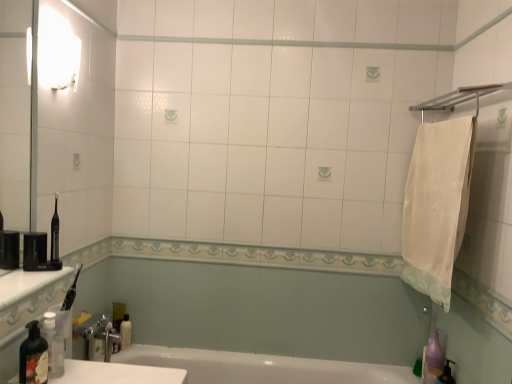
Question: Is there a large distance between transparent plastic bottle at lower left, the first bottle viewed from the back, and white glossy bottle at lower left?

Choices:
 (A) no
 (B) yes

Answer: (A)

Question: From a real-world perspective, is transparent plastic bottle at lower left, the first bottle viewed from the back, positioned over white glossy bottle at lower left based on gravity?

Choices:
 (A) yes
 (B) no

Answer: (A)

Question: Can you confirm if transparent plastic bottle at lower left, the first bottle viewed from the back, is positioned to the left of white glossy bottle at lower left?

Choices:
 (A) yes
 (B) no

Answer: (B)

Question: Can you confirm if transparent plastic bottle at lower left, the 2th bottle from the front, is thinner than white glossy bottle at lower left?

Choices:
 (A) no
 (B) yes

Answer: (A)

Question: Does transparent plastic bottle at lower left, the first bottle viewed from the back, have a smaller size compared to white glossy bottle at lower left?

Choices:
 (A) yes
 (B) no

Answer: (B)

Question: Is white glossy bottle at lower left bigger or smaller than white glossy sink at lower left?

Choices:
 (A) small
 (B) big

Answer: (A)

Question: Does point (128, 344) appear closer or farther from the camera than point (115, 380)?

Choices:
 (A) farther
 (B) closer

Answer: (A)

Question: Considering the positions of white glossy bottle at lower left and white glossy sink at lower left in the image, is white glossy bottle at lower left taller or shorter than white glossy sink at lower left?

Choices:
 (A) tall
 (B) short

Answer: (B)

Question: Considering the relative positions of white glossy bottle at lower left and white glossy sink at lower left in the image provided, is white glossy bottle at lower left to the left or to the right of white glossy sink at lower left?

Choices:
 (A) right
 (B) left

Answer: (B)

Question: Looking at their shapes, would you say transparent plastic bottle at lower left, the 2th bottle from the front, is wider or thinner than white cotton towel at right?

Choices:
 (A) thin
 (B) wide

Answer: (A)

Question: Visually, is transparent plastic bottle at lower left, the 2th bottle from the front, positioned to the left or to the right of white cotton towel at right?

Choices:
 (A) right
 (B) left

Answer: (B)

Question: Is transparent plastic bottle at lower left, the first bottle viewed from the back, in front of or behind white cotton towel at right in the image?

Choices:
 (A) front
 (B) behind

Answer: (A)

Question: From a real-world perspective, is transparent plastic bottle at lower left, the first bottle viewed from the back, above or below white cotton towel at right?

Choices:
 (A) above
 (B) below

Answer: (B)

Question: From a real-world perspective, relative to white glossy sink at lower left, is translucent plastic soap dispenser at lower left, the first bottle in the front-to-back sequence, vertically above or below?

Choices:
 (A) below
 (B) above

Answer: (B)

Question: Looking at their shapes, would you say translucent plastic soap dispenser at lower left, the first bottle in the front-to-back sequence, is wider or thinner than white glossy sink at lower left?

Choices:
 (A) thin
 (B) wide

Answer: (A)